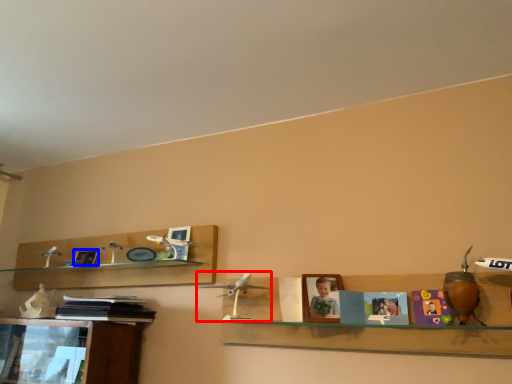
Question: Which point is further to the camera, toy (highlighted by a red box) or picture frame (highlighted by a blue box)?

Choices:
 (A) toy
 (B) picture frame

Answer: (B)